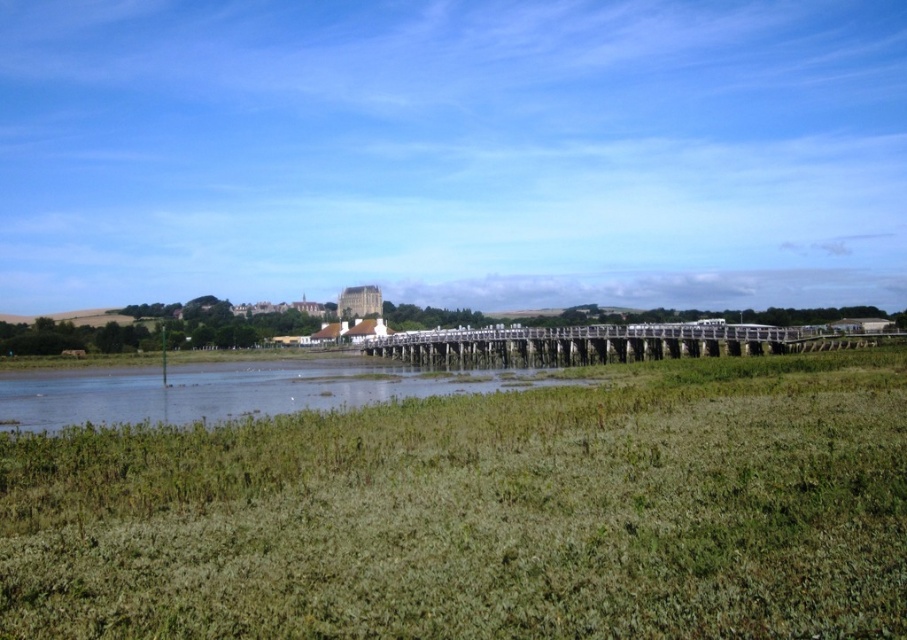
You are standing at the point closer to the camera between the two points, point [373,371] and point [781,339]. Which point are you standing at?

You are standing at point [373,371] because it is closer to the camera than point [781,339].

You are standing at the point marked by the coordinates point (483, 513), which is labeled as green grassy at center. Looking around, you notice the long wooden pier extending into the water. Can you determine the direction of the pier relative to your current position?

The point (483, 513) marks green grassy at center, and the long wooden pier extends into the water from the background. Since the pier is in the background, it is located behind the green grassy at center, so the pier is behind you relative to your current position at point (483, 513).